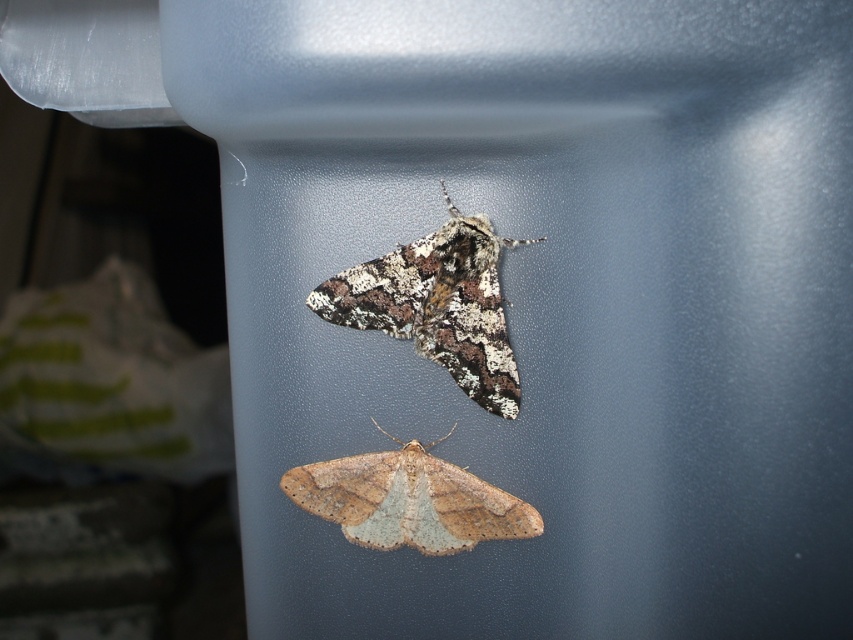
You are a photographer trying to capture a closeup of the speckled brown moth at center and the brown speckled moth at center. Which one would appear larger in your photo?

The speckled brown moth at center would appear larger in the photo because it is closer to the viewer than the brown speckled moth at center.

You are a photographer aiming to capture a closeup of the speckled brown moth at center. The camera is currently focused at point 0.5, 0.5. Do you need to adjust the focus point to ensure the moth is sharp in the photo?

The speckled brown moth at center is at point (x=437, y=305), which is very close to the current focus point of (x=426, y=320). Therefore, no adjustment is needed for the focus point to capture the moth sharply.